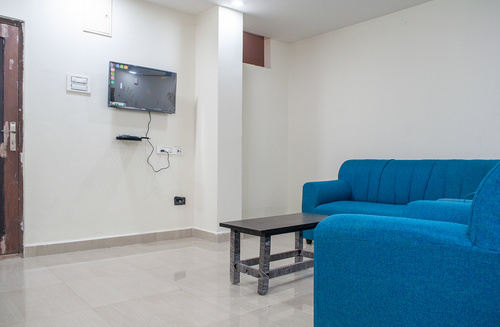
Where is `table`? This screenshot has width=500, height=327. table is located at coordinates (274, 224).